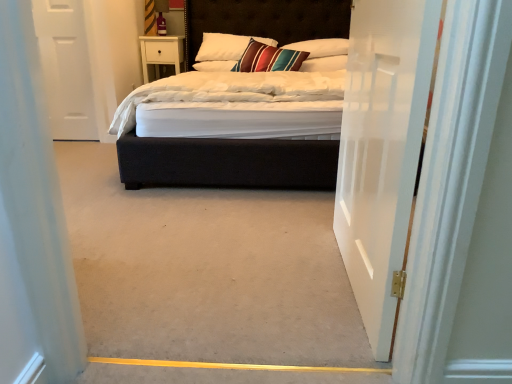
Question: Is white soft pillow at upper center, which appears as the 3th pillow when viewed from the left, far away from velvet-like multicolored pillow at center, which is the second pillow from left to right?

Choices:
 (A) yes
 (B) no

Answer: (B)

Question: Is white soft pillow at upper center, acting as the 2th pillow starting from the right, thinner than velvet-like multicolored pillow at center, which is the second pillow from left to right?

Choices:
 (A) yes
 (B) no

Answer: (A)

Question: From a real-world perspective, is white soft pillow at upper center, which appears as the 3th pillow when viewed from the left, below velvet-like multicolored pillow at center, which is the second pillow from left to right?

Choices:
 (A) no
 (B) yes

Answer: (B)

Question: Can you confirm if white soft pillow at upper center, acting as the 2th pillow starting from the right, is bigger than velvet-like multicolored pillow at center, which appears as the 3th pillow when viewed from the right?

Choices:
 (A) no
 (B) yes

Answer: (A)

Question: Considering the relative positions of white soft pillow at upper center, which appears as the 3th pillow when viewed from the left, and velvet-like multicolored pillow at center, which appears as the 3th pillow when viewed from the right, in the image provided, is white soft pillow at upper center, which appears as the 3th pillow when viewed from the left, behind velvet-like multicolored pillow at center, which appears as the 3th pillow when viewed from the right,?

Choices:
 (A) yes
 (B) no

Answer: (B)

Question: From a real-world perspective, is white soft pillow at upper center, which appears as the 3th pillow when viewed from the left, located higher than velvet-like multicolored pillow at center, which appears as the 3th pillow when viewed from the right?

Choices:
 (A) no
 (B) yes

Answer: (A)

Question: Is white glossy door at center, arranged as the 1th door when viewed from the right, facing towards white soft pillow at center, the 1th pillow positioned from the left?

Choices:
 (A) yes
 (B) no

Answer: (B)

Question: Is white glossy door at center, arranged as the 1th door when viewed from the right, positioned behind white soft pillow at center, which is counted as the fourth pillow, starting from the right?

Choices:
 (A) yes
 (B) no

Answer: (B)

Question: Is white glossy door at center, arranged as the 1th door when viewed from the right, outside white soft pillow at center, which is counted as the fourth pillow, starting from the right?

Choices:
 (A) yes
 (B) no

Answer: (A)

Question: From the image's perspective, does white glossy door at center, which is counted as the 2th door, starting from the back, appear lower than white soft pillow at center, the 1th pillow positioned from the left?

Choices:
 (A) no
 (B) yes

Answer: (B)

Question: Considering the relative sizes of white glossy door at center, arranged as the 1th door when viewed from the right, and white soft pillow at center, the 1th pillow positioned from the left, in the image provided, is white glossy door at center, arranged as the 1th door when viewed from the right, thinner than white soft pillow at center, the 1th pillow positioned from the left,?

Choices:
 (A) yes
 (B) no

Answer: (A)

Question: Is the surface of white glossy door at center, the 1th door positioned from the front, in direct contact with white soft pillow at center, the 1th pillow positioned from the left?

Choices:
 (A) yes
 (B) no

Answer: (B)

Question: Would you say white glossy door at center, which is counted as the 2th door, starting from the back, is a long distance from velvet-like multicolored pillow at center, which is the second pillow from left to right?

Choices:
 (A) yes
 (B) no

Answer: (A)